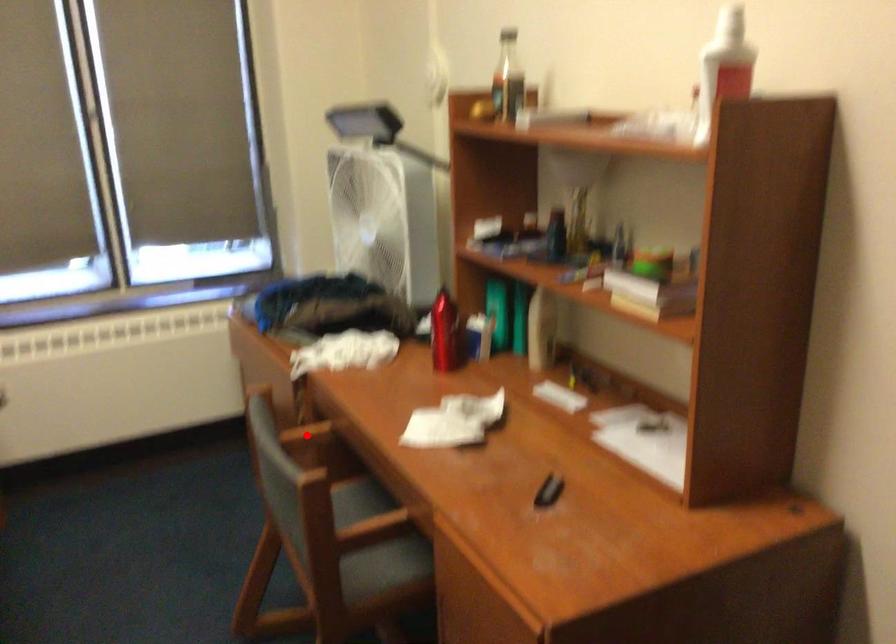
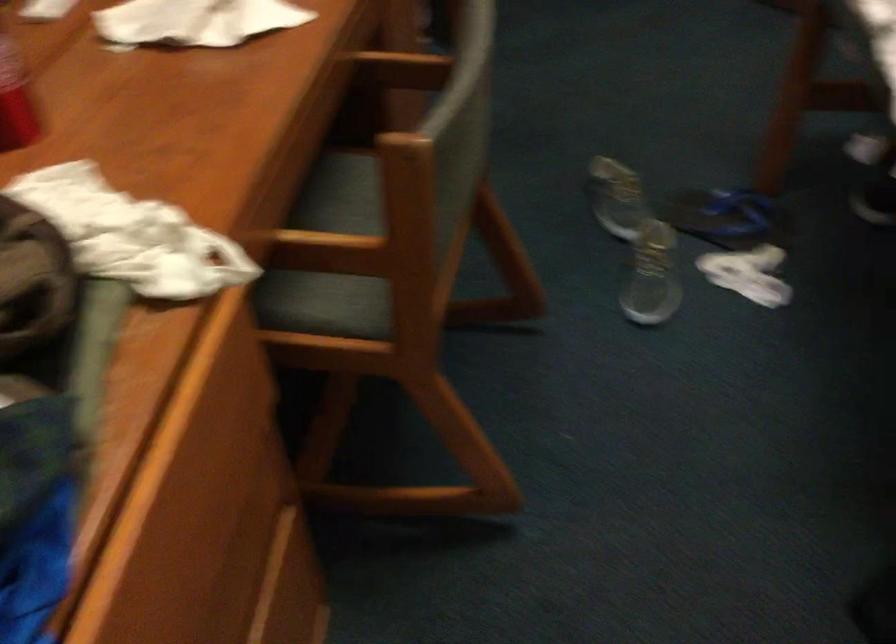
Question: I am providing you with two images of the same scene from different viewpoints. A red point is marked on the first image. Is the red point's position out of view in image 2?

Choices:
 (A) Yes
 (B) No

Answer: (A)